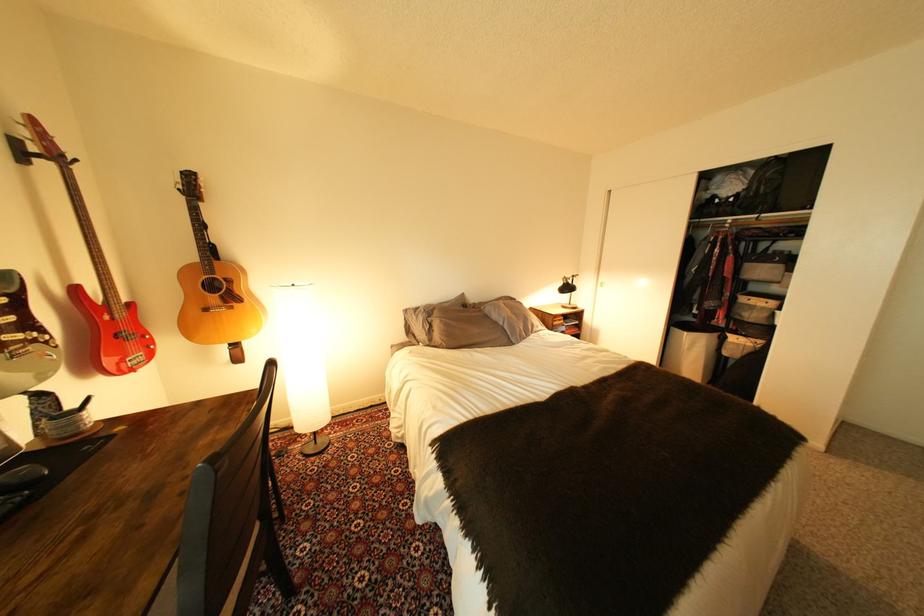
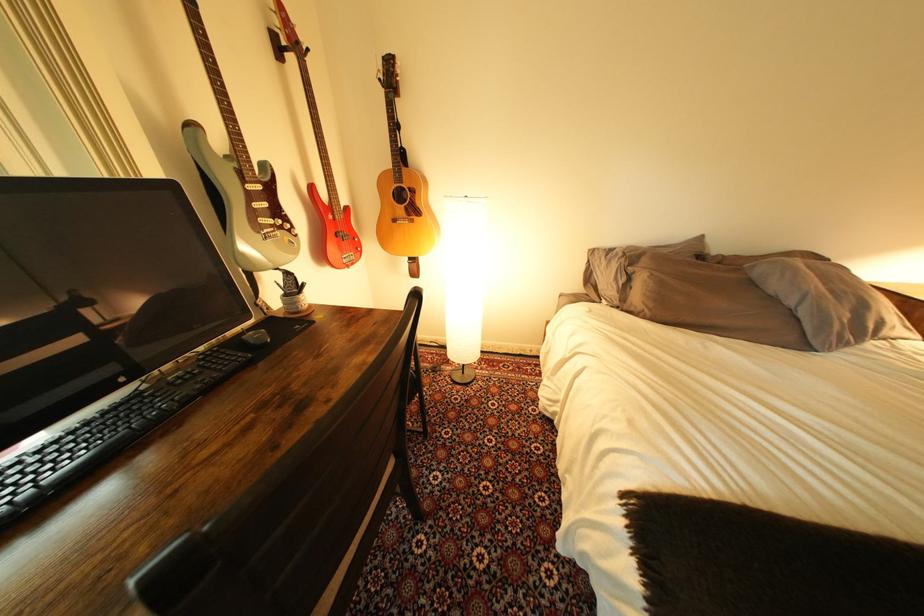
In the second image, find the point that corresponds to the point at 26,350 in the first image.

(278, 233)